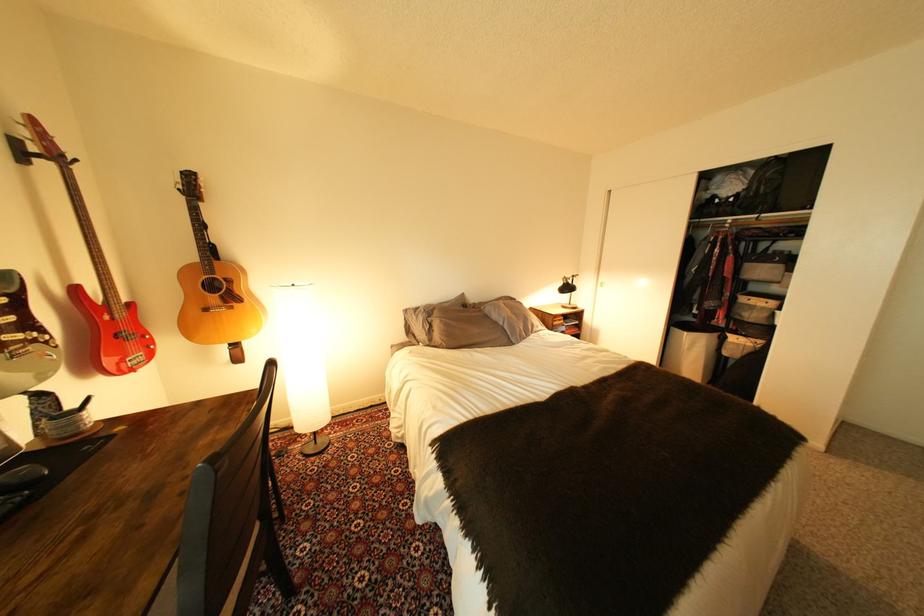
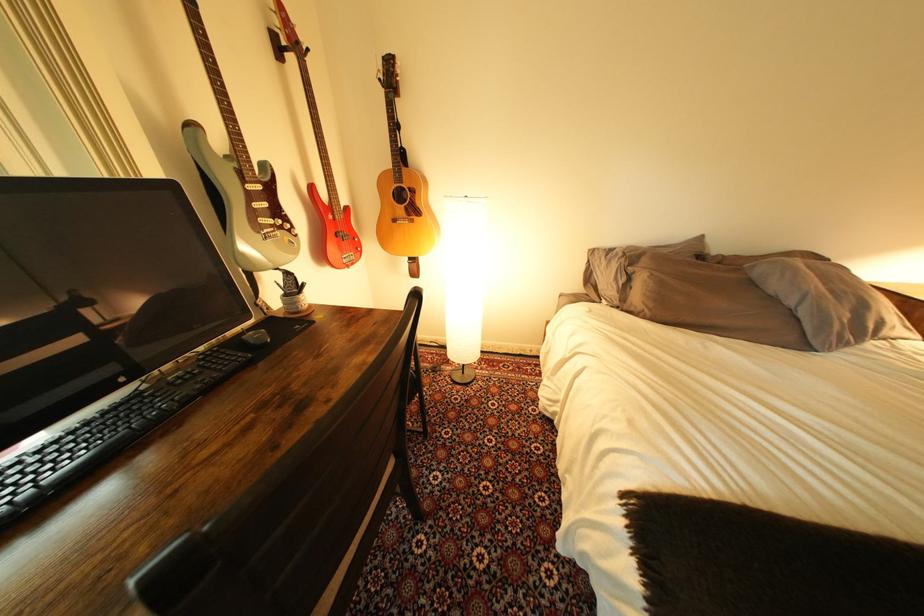
In the second image, find the point that corresponds to the point at 26,350 in the first image.

(278, 233)